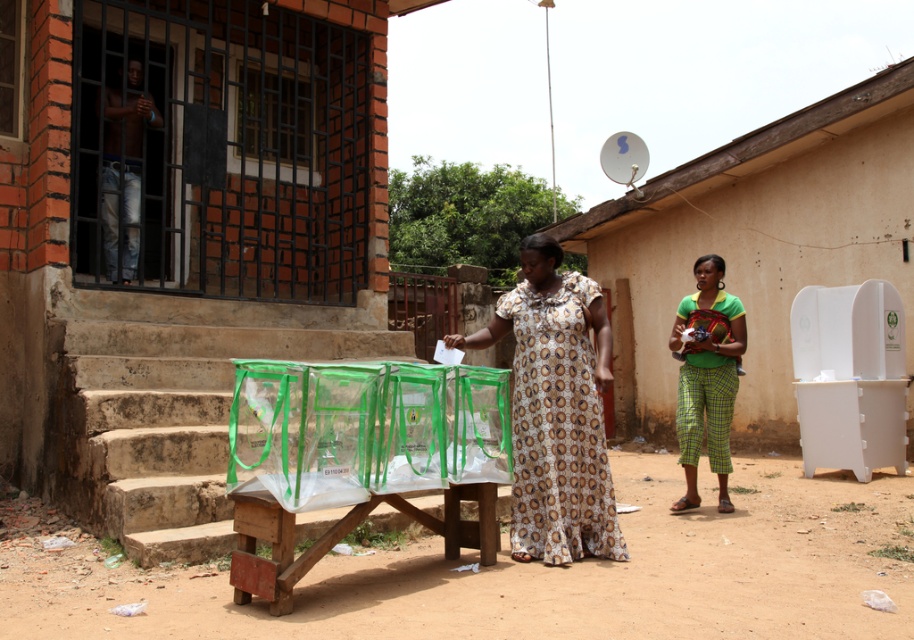
Who is more distant from viewer, (804, 128) or (705, 253)?

The point (804, 128) is more distant.

Where is `white plastic ballot box at center`? white plastic ballot box at center is located at coordinates (756, 244).

Is the position of green plastic bags at left less distant than that of jeans at left?

Yes, it is in front of jeans at left.

What do you see at coordinates (176, 416) in the screenshot? I see `green plastic bags at left` at bounding box center [176, 416].

Where is `green plastic bags at left`? green plastic bags at left is located at coordinates pyautogui.click(x=176, y=416).

Between printed fabric dress at center and green plaid pants at right, which one appears on the right side from the viewer's perspective?

green plaid pants at right is more to the right.

What are the coordinates of `printed fabric dress at center` in the screenshot? It's located at (556, 410).

The width and height of the screenshot is (914, 640). Describe the element at coordinates (556, 410) in the screenshot. I see `printed fabric dress at center` at that location.

Identify the location of printed fabric dress at center. (556, 410).